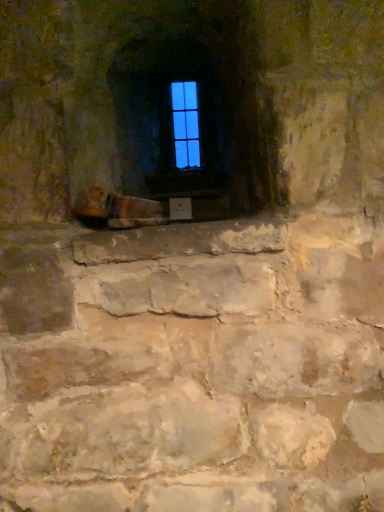
Where is `blue glass window at center`? blue glass window at center is located at coordinates (185, 124).

The height and width of the screenshot is (512, 384). Describe the element at coordinates (185, 124) in the screenshot. I see `blue glass window at center` at that location.

Where is `blue glass window at center`? Image resolution: width=384 pixels, height=512 pixels. blue glass window at center is located at coordinates (185, 124).